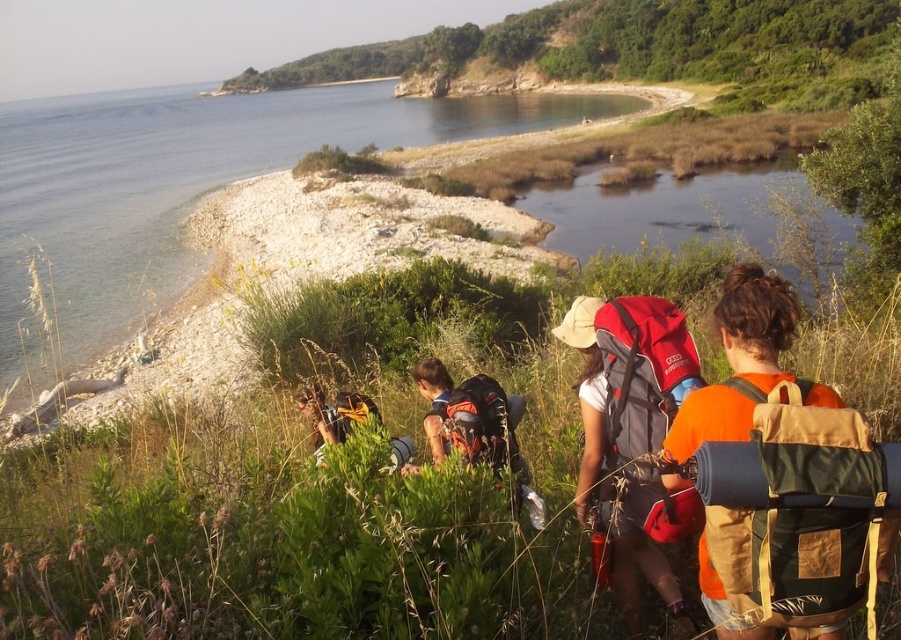
Question: Which object is the closest to the clear blue water at upper left?

Choices:
 (A) matte gray backpack at center
 (B) green leafy hillside at upper center
 (C) orange fabric backpack at center right

Answer: (B)

Question: Does green leafy grass at center appear over matte black backpack at center?

Choices:
 (A) yes
 (B) no

Answer: (B)

Question: Estimate the real-world distances between objects in this image. Which object is farther from the green leafy hillside at upper center?

Choices:
 (A) green leafy grass at center
 (B) matte gray backpack at center

Answer: (A)

Question: Is clear blue water at upper left thinner than brushed metal backpack at lower center?

Choices:
 (A) yes
 (B) no

Answer: (B)

Question: Is clear blue water at upper left wider than orange fabric backpack at center right?

Choices:
 (A) yes
 (B) no

Answer: (A)

Question: Which of the following is the closest to the observer?

Choices:
 (A) (302, 516)
 (B) (488, 449)
 (C) (745, 406)
 (D) (690, 509)

Answer: (C)